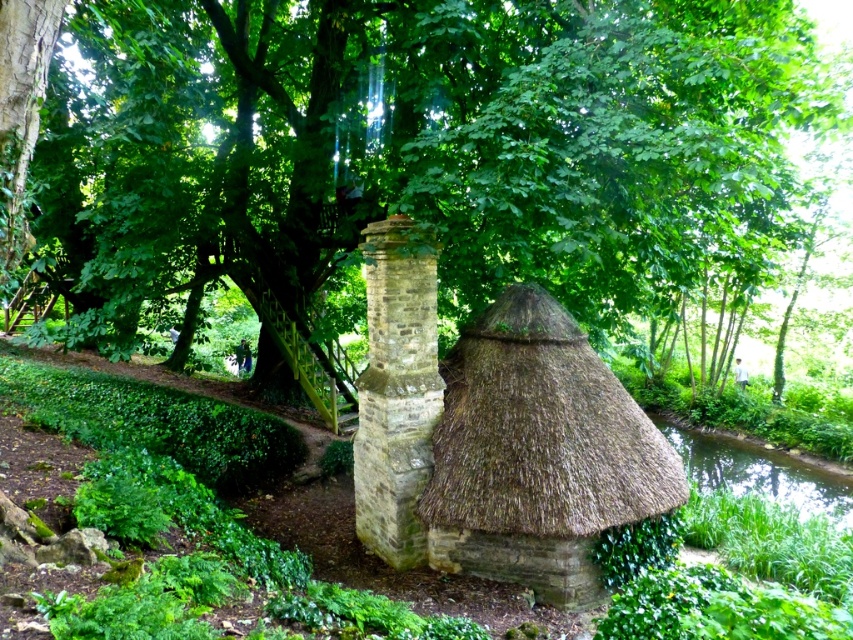
Does brown thatch roof at center lie behind green grassy bank at lower right?

No, brown thatch roof at center is closer to the viewer.

Is brown thatch roof at center closer to the viewer compared to green grassy bank at lower right?

Yes, it is.

Does point (619, 515) come closer to viewer compared to point (740, 458)?

That is True.

The image size is (853, 640). I want to click on brown thatch roof at center, so click(x=541, y=432).

Based on the photo, can you confirm if green leafy tree at center is smaller than brown thatch roof at center?

Actually, green leafy tree at center might be larger than brown thatch roof at center.

Is green leafy tree at center closer to camera compared to brown thatch roof at center?

Yes, green leafy tree at center is in front of brown thatch roof at center.

Where is `green leafy tree at center`? The width and height of the screenshot is (853, 640). green leafy tree at center is located at coordinates (421, 147).

Does green leafy tree at center have a larger size compared to brown stone chimney at center?

Indeed, green leafy tree at center has a larger size compared to brown stone chimney at center.

Is point (292, 305) farther from viewer compared to point (410, 540)?

Yes, it is behind point (410, 540).

The height and width of the screenshot is (640, 853). Describe the element at coordinates (421, 147) in the screenshot. I see `green leafy tree at center` at that location.

This screenshot has height=640, width=853. Find the location of `green leafy tree at center`. green leafy tree at center is located at coordinates (421, 147).